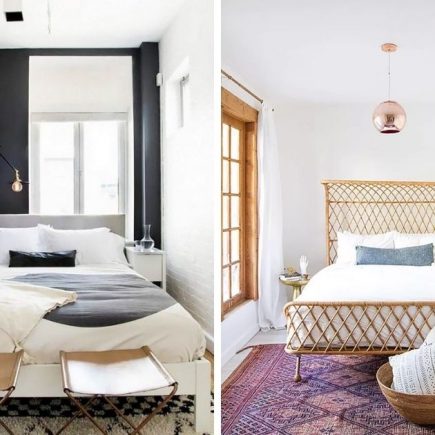
You are a GUI agent. You are given a task and a screenshot of the screen. Output one action in this format:
    pyautogui.click(x=<x>, y=<y>)
    Task: Click on the pillows in basket
    The height and width of the screenshot is (435, 435).
    Given the screenshot: What is the action you would take?
    pyautogui.click(x=412, y=373)